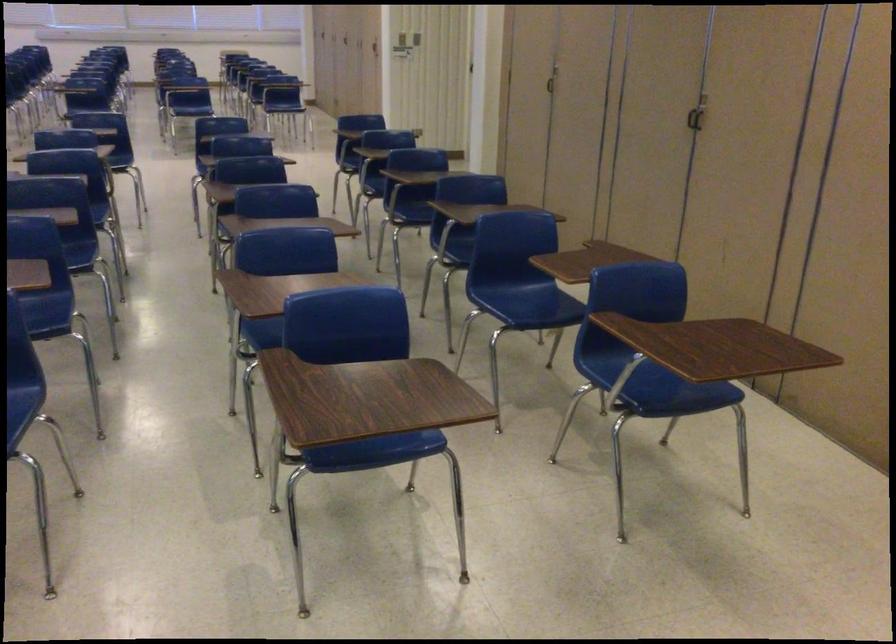
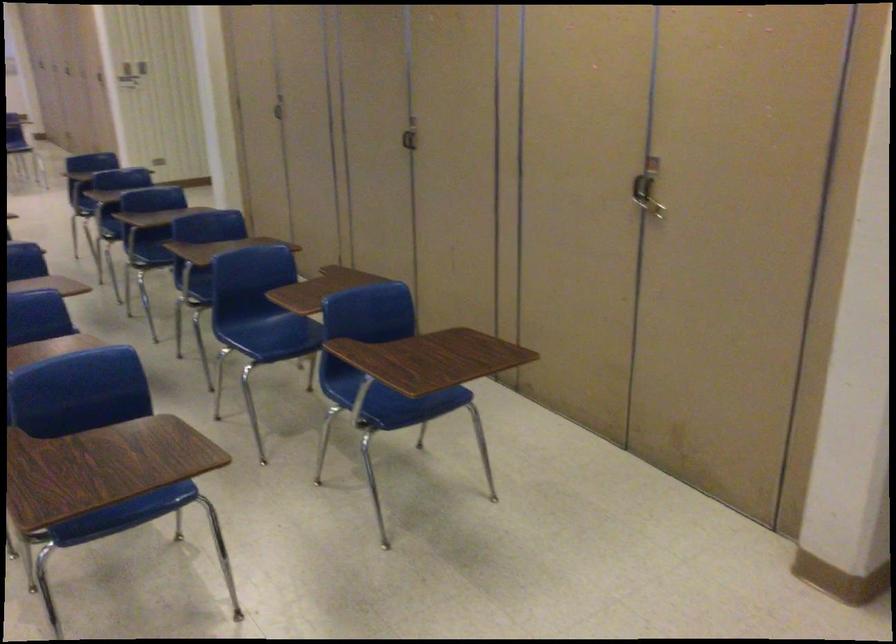
The point at (x=526, y=298) is marked in the first image. Where is the corresponding point in the second image?

(272, 328)